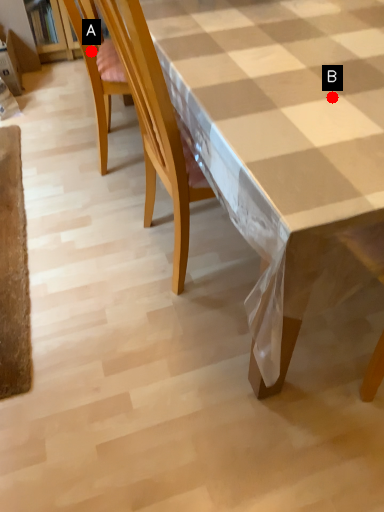
Question: Two points are circled on the image, labeled by A and B beside each circle. Among these points, which one is farthest from the camera?

Choices:
 (A) A is further
 (B) B is further

Answer: (A)